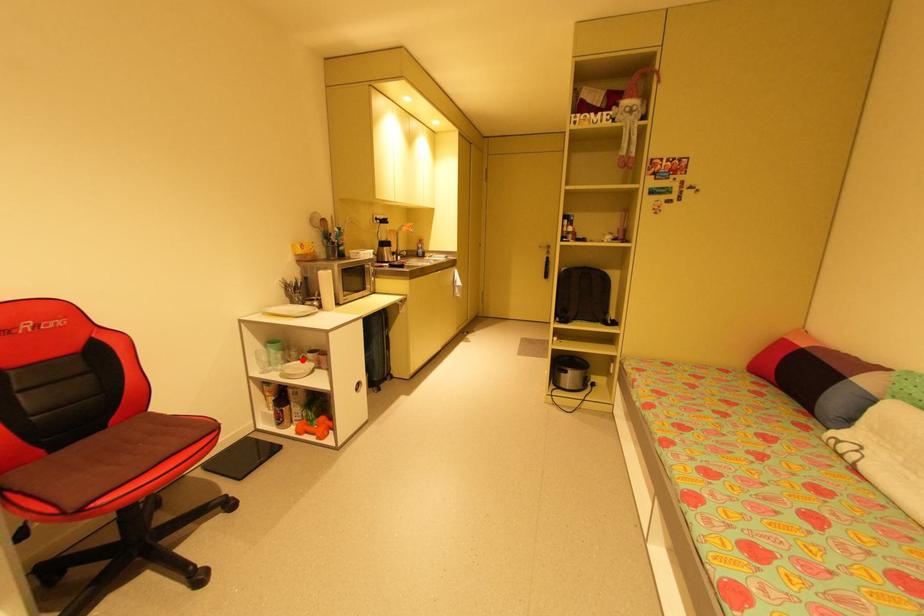
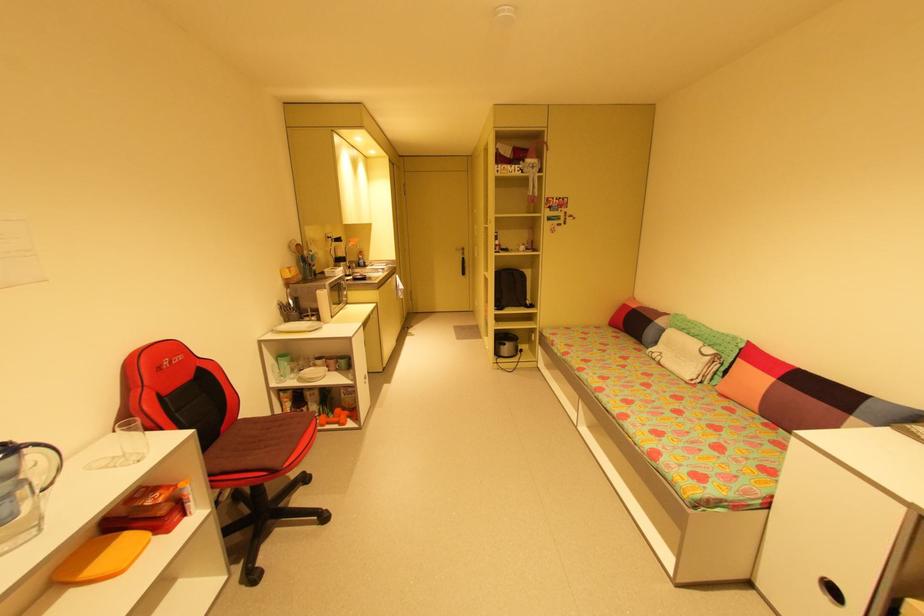
The point at the highlighted location is marked in the first image. Where is the corresponding point in the second image?

(313, 367)